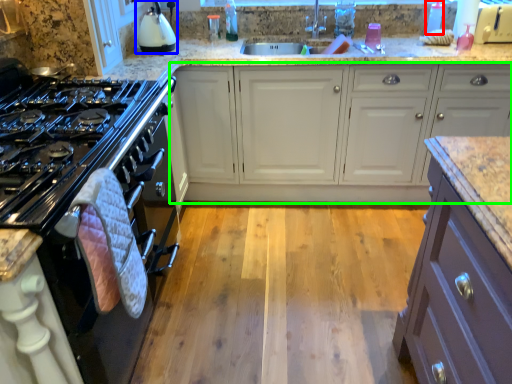
Question: Estimate the real-world distances between objects in this image. Which object is closer to bottle (highlighted by a red box), kitchen appliance (highlighted by a blue box) or cabinetry (highlighted by a green box)?

Choices:
 (A) kitchen appliance
 (B) cabinetry

Answer: (B)